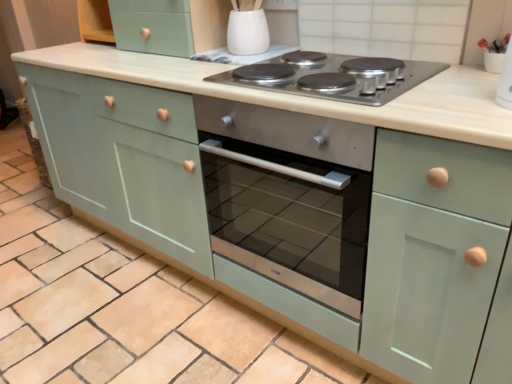
Question: Is stainless steel cooktop at center situated inside white glossy vase at upper center or outside?

Choices:
 (A) inside
 (B) outside

Answer: (B)

Question: Based on their positions, is stainless steel cooktop at center located to the left or right of white glossy vase at upper center?

Choices:
 (A) left
 (B) right

Answer: (B)

Question: Considering the positions of stainless steel cooktop at center and white glossy vase at upper center in the image, is stainless steel cooktop at center taller or shorter than white glossy vase at upper center?

Choices:
 (A) short
 (B) tall

Answer: (A)

Question: Considering the relative positions of white glossy vase at upper center and stainless steel cooktop at center in the image provided, is white glossy vase at upper center to the left or to the right of stainless steel cooktop at center?

Choices:
 (A) left
 (B) right

Answer: (A)

Question: From a real-world perspective, relative to stainless steel cooktop at center, is white glossy vase at upper center vertically above or below?

Choices:
 (A) above
 (B) below

Answer: (A)

Question: In the image, is white glossy vase at upper center positioned in front of or behind stainless steel cooktop at center?

Choices:
 (A) front
 (B) behind

Answer: (B)

Question: In terms of size, does white glossy vase at upper center appear bigger or smaller than stainless steel cooktop at center?

Choices:
 (A) small
 (B) big

Answer: (A)